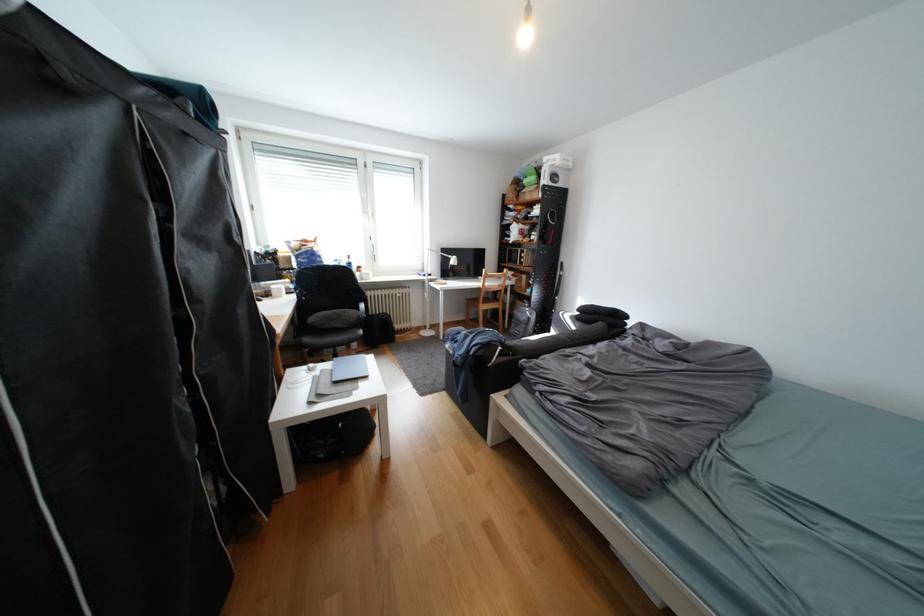
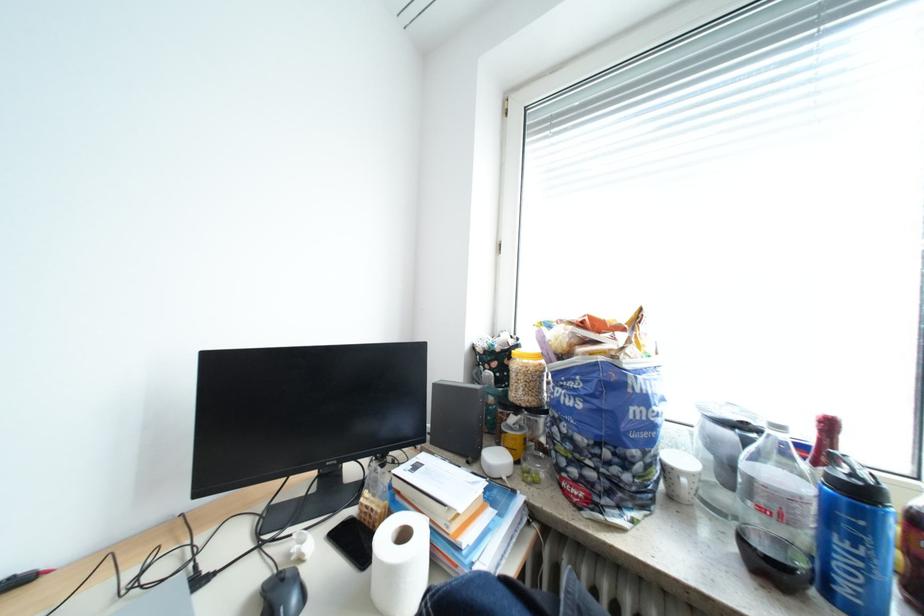
Find the pixel in the second image that matches pixel 362 265 in the first image.

(873, 493)